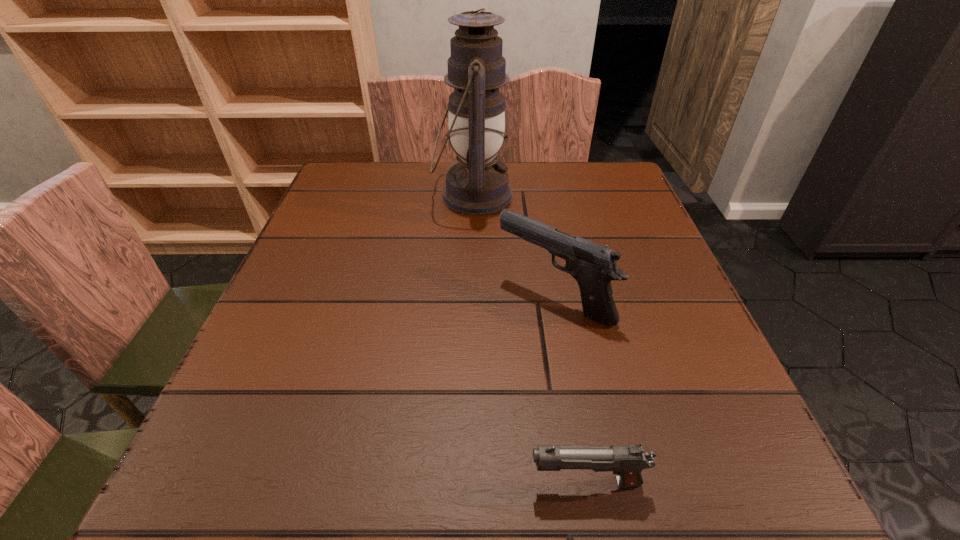
Identify the location of oil lamp. The width and height of the screenshot is (960, 540). (476, 185).

This screenshot has width=960, height=540. I want to click on the farthest object, so click(476, 185).

You are a GUI agent. You are given a task and a screenshot of the screen. Output one action in this format:
    pyautogui.click(x=<x>, y=<y>)
    Task: Click on the farther gun
    This screenshot has width=960, height=540.
    Given the screenshot: What is the action you would take?
    pyautogui.click(x=593, y=266)

What are the coordinates of `the second nearest object` in the screenshot? It's located at (593, 266).

You are a GUI agent. You are given a task and a screenshot of the screen. Output one action in this format:
    pyautogui.click(x=<x>, y=<y>)
    Task: Click on the shortest object
    
    Given the screenshot: What is the action you would take?
    pyautogui.click(x=627, y=461)

Locate an element on the screen. The width and height of the screenshot is (960, 540). the nearest object is located at coordinates (627, 461).

Locate an element on the screen. Image resolution: width=960 pixels, height=540 pixels. blank area located 0.290m on the right of the tallest object is located at coordinates (629, 195).

Locate an element on the screen. Image resolution: width=960 pixels, height=540 pixels. blank space located at the muzzle of the second tallest object is located at coordinates (403, 298).

Locate an element on the screen. free point located 0.180m at the muzzle of the second tallest object is located at coordinates (403, 298).

This screenshot has height=540, width=960. In order to click on vacant space located at the muzzle of the second tallest object in this screenshot , I will do `click(287, 298)`.